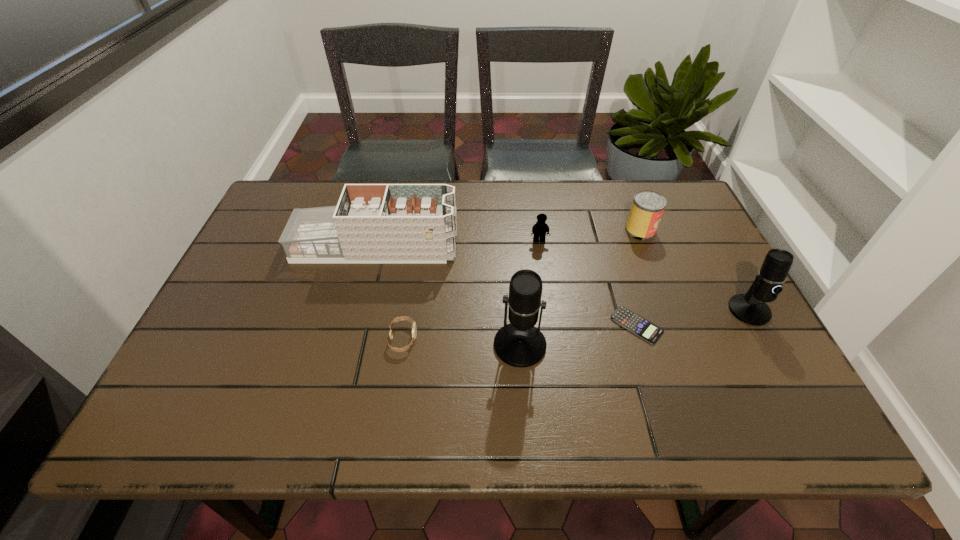
I want to click on the left microphone, so [x=520, y=344].

The width and height of the screenshot is (960, 540). Identify the location of the taller microphone. (520, 344).

This screenshot has height=540, width=960. Find the location of `the rightmost object`. the rightmost object is located at coordinates (750, 308).

The width and height of the screenshot is (960, 540). Find the location of `the shorter microphone`. the shorter microphone is located at coordinates (750, 308).

The height and width of the screenshot is (540, 960). Identify the location of dollhouse. (378, 223).

You are a GUI agent. You are given a task and a screenshot of the screen. Output one action in this format:
    pyautogui.click(x=<x>, y=<y>)
    Task: Click on the Lego
    This screenshot has height=540, width=960.
    Given the screenshot: What is the action you would take?
    pyautogui.click(x=539, y=229)

You are a GUI agent. You are given a task and a screenshot of the screen. Output one action in this format:
    pyautogui.click(x=<x>, y=<y>)
    Task: Click on the shortest object
    The height and width of the screenshot is (540, 960).
    Given the screenshot: What is the action you would take?
    click(641, 327)

Find the location of a particular element. This screenshot has width=960, height=540. can is located at coordinates (x=647, y=208).

This screenshot has width=960, height=540. I want to click on watch, so click(x=414, y=328).

Where is `free region located 0.400m on the right of the taller microphone`? free region located 0.400m on the right of the taller microphone is located at coordinates (723, 345).